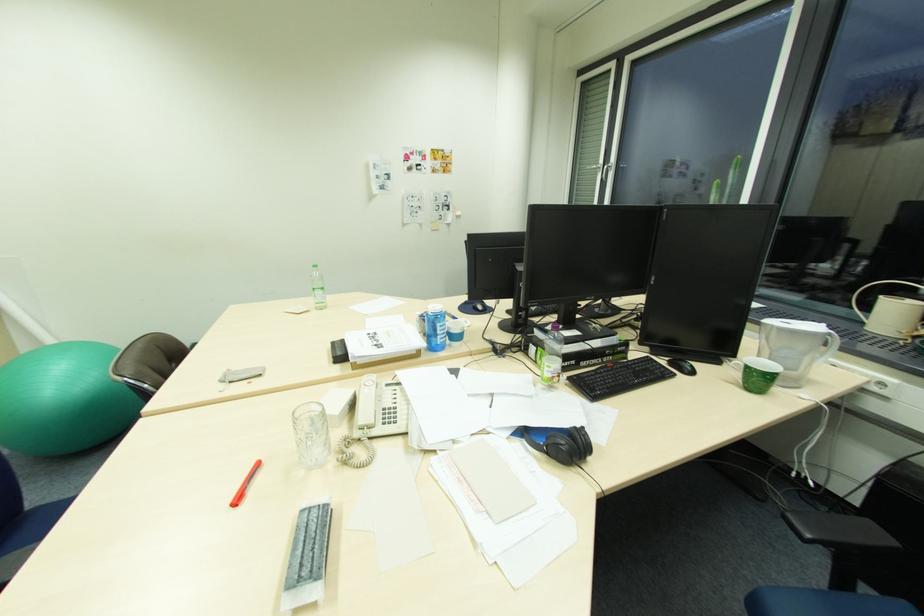
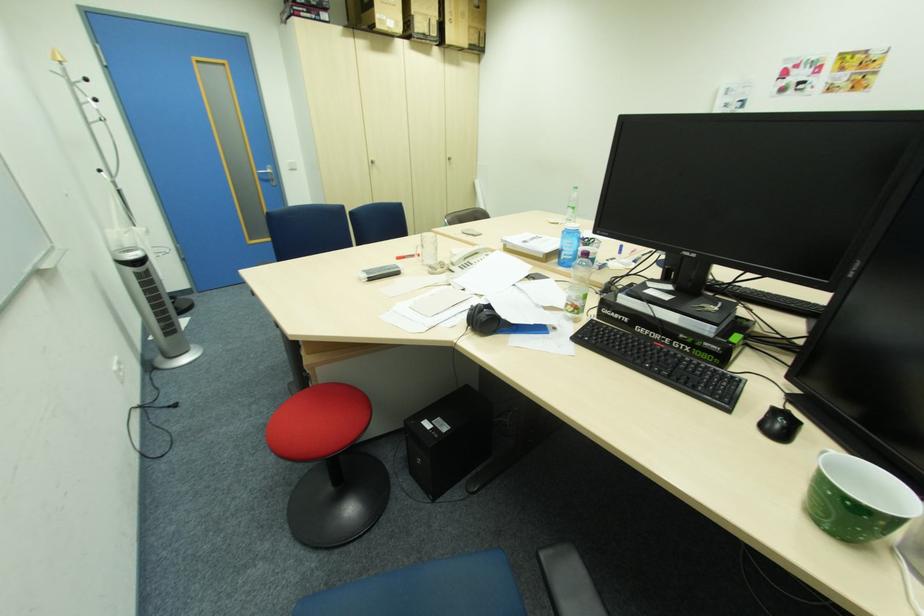
The point at (562, 376) is marked in the first image. Where is the corresponding point in the second image?

(575, 304)